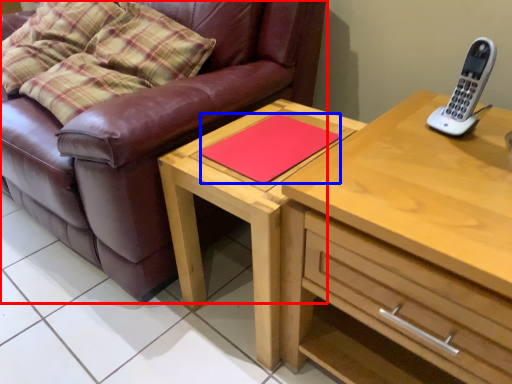
Question: Which point is closer to the camera, studio couch (highlighted by a red box) or pad (highlighted by a blue box)?

Choices:
 (A) studio couch
 (B) pad

Answer: (A)